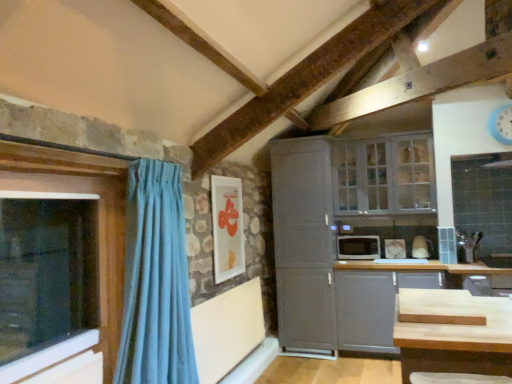
Question: Is transparent glass window at left, arranged as the 2th window when viewed from the back, taller or shorter than white glass cabinet at upper right, the second window when ordered from front to back?

Choices:
 (A) tall
 (B) short

Answer: (A)

Question: From a real-world perspective, relative to white glass cabinet at upper right, which ranks as the 1th window in right-to-left order, is transparent glass window at left, arranged as the 2th window when viewed from the back, vertically above or below?

Choices:
 (A) above
 (B) below

Answer: (B)

Question: Considering the real-world distances, which object is closest to the white glossy microwave at center-right?

Choices:
 (A) matte gray cabinet at lower right, placed as the 2th cabinetry when sorted from left to right
 (B) white glossy picture frame at upper center
 (C) blue plastic clock at upper right
 (D) white glass cabinet at upper right, which is the 1th window from back to front
 (E) satin gray cabinet at center, positioned as the first cabinetry in left-to-right order

Answer: (A)

Question: Which object is positioned closest to the transparent glass window at left, acting as the 1th window starting from the front?

Choices:
 (A) white glass cabinet at upper right, which ranks as the 1th window in right-to-left order
 (B) light blue fabric curtain at left
 (C) white glossy microwave at center-right
 (D) matte gray cabinet at lower right, placed as the 2th cabinetry when sorted from left to right
 (E) satin gray cabinet at center, positioned as the first cabinetry in left-to-right order

Answer: (B)